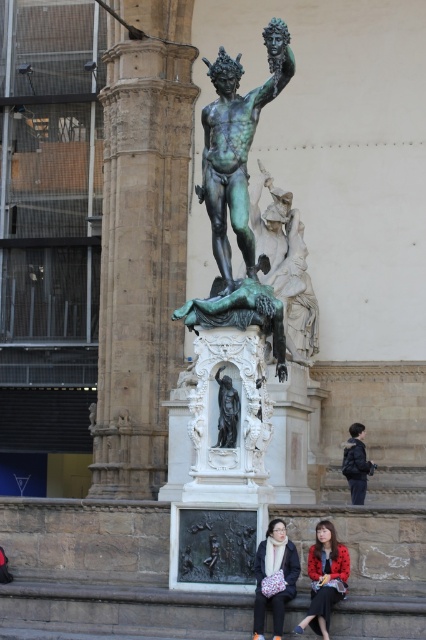
Question: Can you confirm if red textured coat at lower center is smaller than black polished statue at center?

Choices:
 (A) yes
 (B) no

Answer: (B)

Question: Estimate the real-world distances between objects in this image. Which object is farther from the bronze statue at center?

Choices:
 (A) dark blue jacket at lower right
 (B) matte black coat at lower center

Answer: (A)

Question: Which object is the closest to the black polished statue at center?

Choices:
 (A) matte black coat at lower center
 (B) dark blue jacket at lower right
 (C) red textured coat at lower center
 (D) bronze statue at center

Answer: (A)

Question: Where is bronze statue at center located in relation to matte black coat at lower center in the image?

Choices:
 (A) left
 (B) right

Answer: (A)

Question: Considering the real-world distances, which object is farthest from the bronze statue at center?

Choices:
 (A) matte black coat at lower center
 (B) black polished statue at center

Answer: (A)

Question: Does bronze statue at center have a larger size compared to matte black coat at lower center?

Choices:
 (A) yes
 (B) no

Answer: (A)